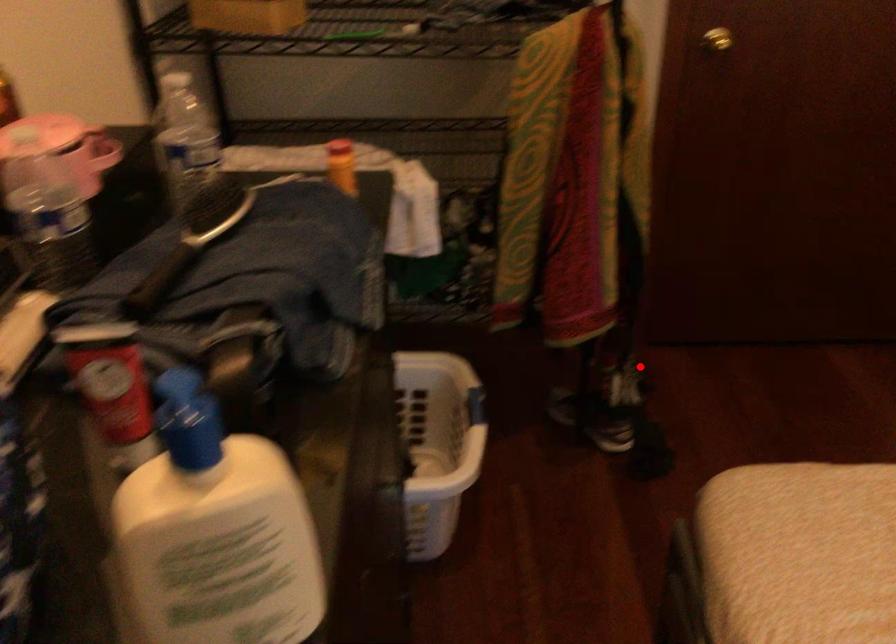
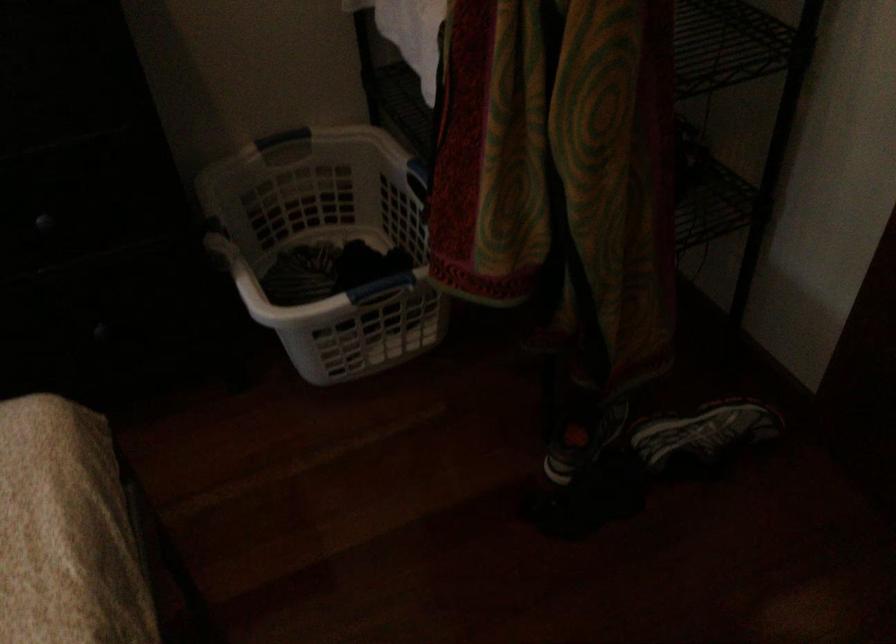
Question: I am providing you with two images of the same scene from different viewpoints. Image1 has a red point marked. In image2, the corresponding 3D location appears at what relative position? Reply with the corresponding letter.

Choices:
 (A) Closer
 (B) Farther

Answer: (A)